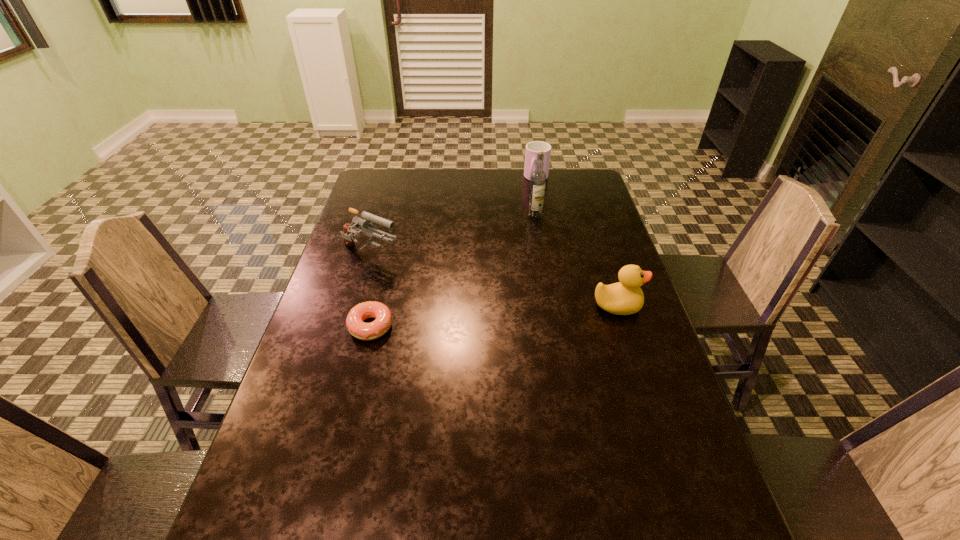
Identify the location of vacant area at the far edge. (503, 177).

The height and width of the screenshot is (540, 960). In order to click on vacant space at the left edge of the desktop in this screenshot , I will do `click(338, 303)`.

In order to click on vacant area at the right edge of the desktop in this screenshot , I will do `click(573, 212)`.

Identify the location of free point at the far right corner. The width and height of the screenshot is (960, 540). (565, 186).

Image resolution: width=960 pixels, height=540 pixels. I want to click on free space between the rightmost object and the doughnut, so click(x=493, y=316).

You are a GUI agent. You are given a task and a screenshot of the screen. Output one action in this format:
    pyautogui.click(x=<x>, y=<y>)
    Task: Click on the unoccupied area between the gun and the doughnut
    
    Given the screenshot: What is the action you would take?
    pyautogui.click(x=371, y=291)

What are the coordinates of `free space between the gun and the fourth nearest object` in the screenshot? It's located at (453, 235).

This screenshot has height=540, width=960. I want to click on vacant space that is in between the third farthest object and the vodka, so click(453, 235).

You are a GUI agent. You are given a task and a screenshot of the screen. Output one action in this format:
    pyautogui.click(x=<x>, y=<y>)
    Task: Click on the free spot between the duck and the gun
    The height and width of the screenshot is (540, 960).
    Given the screenshot: What is the action you would take?
    pyautogui.click(x=493, y=281)

The height and width of the screenshot is (540, 960). In order to click on empty space that is in between the farthest object and the rightmost object in this screenshot , I will do `click(577, 242)`.